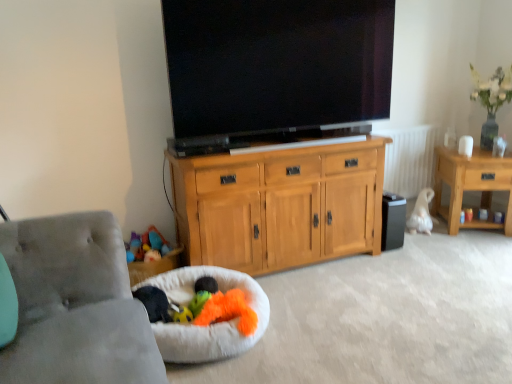
Locate an element on the screen. This screenshot has width=512, height=384. empty space that is to the right of black plastic speaker at lower right is located at coordinates (409, 244).